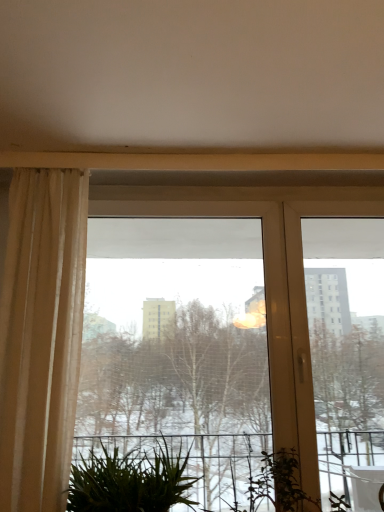
Question: Is green leafy plant at lower center taller or shorter than beige sheer curtain at left?

Choices:
 (A) tall
 (B) short

Answer: (B)

Question: From the image's perspective, is green leafy plant at lower center positioned above or below beige sheer curtain at left?

Choices:
 (A) below
 (B) above

Answer: (A)

Question: Which object is positioned closest to the transparent glass window at center?

Choices:
 (A) green leafy plant at lower center
 (B) beige sheer curtain at left

Answer: (B)

Question: Estimate the real-world distances between objects in this image. Which object is farther from the green leafy plant at lower center?

Choices:
 (A) transparent glass window at center
 (B) beige sheer curtain at left

Answer: (A)